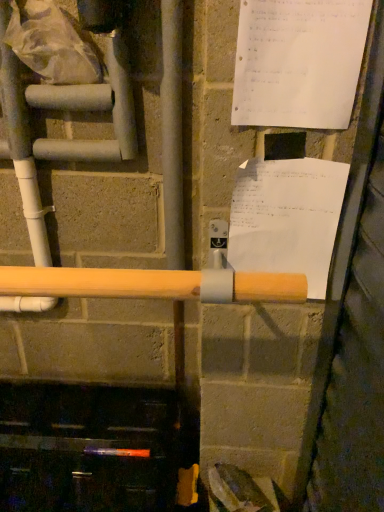
Question: Is translucent plastic bag at upper left inside or outside of white plastic water pipe at left?

Choices:
 (A) inside
 (B) outside

Answer: (B)

Question: From the image's perspective, is translucent plastic bag at upper left above or below white plastic water pipe at left?

Choices:
 (A) above
 (B) below

Answer: (A)

Question: Based on their relative distances, which object is farther from the white plastic water pipe at left?

Choices:
 (A) translucent plastic bag at upper left
 (B) white paper at upper right, marked as the first paper in a back-to-front arrangement
 (C) white paper at upper right, the first paper when ordered from top to bottom

Answer: (B)

Question: Considering the real-world distances, which object is farthest from the white paper at upper right, the second paper when ordered from front to back?

Choices:
 (A) white plastic water pipe at left
 (B) white paper at upper right, which is the second paper from back to front
 (C) translucent plastic bag at upper left

Answer: (A)